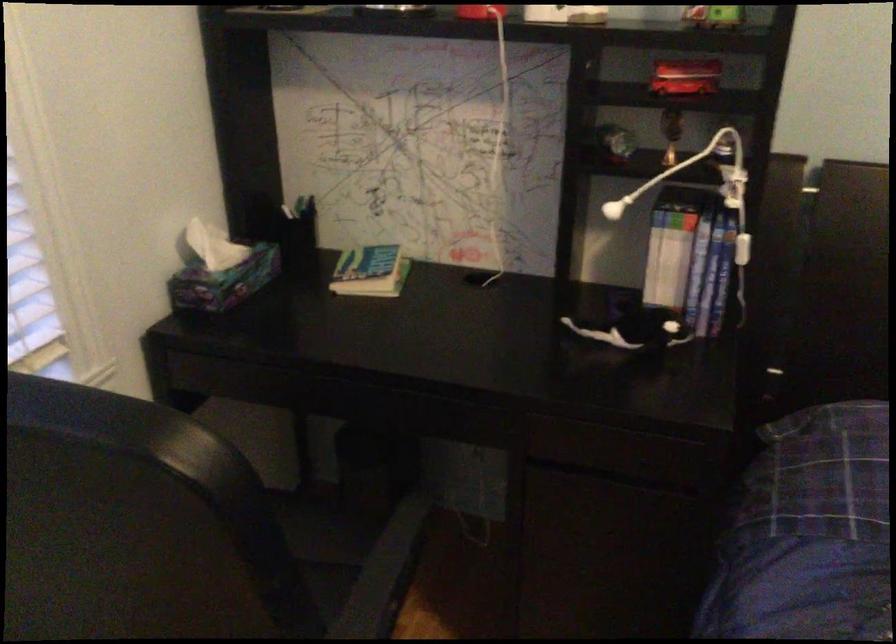
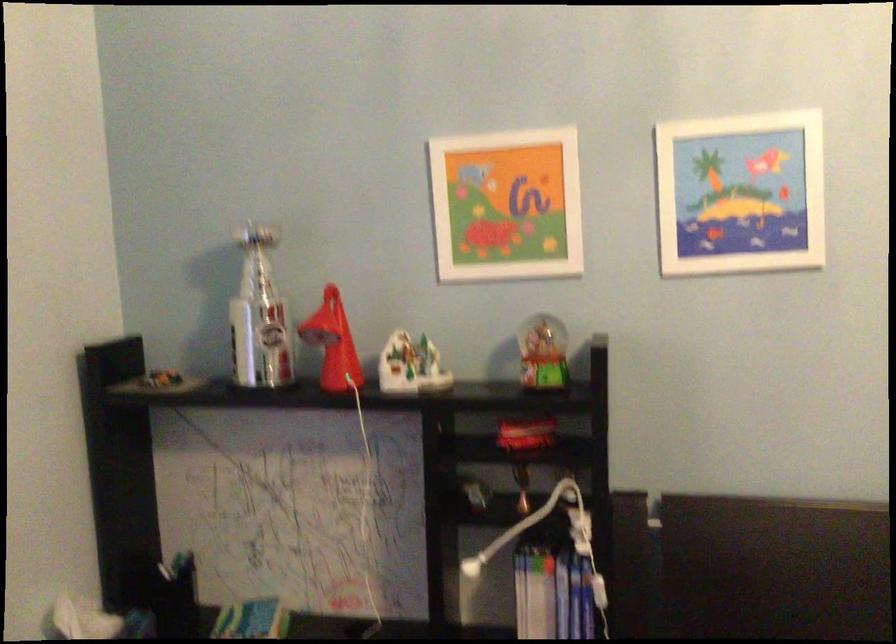
The images are taken continuously from a first-person perspective. In which direction are you moving?

The movement direction of the cameraman is right, backward.